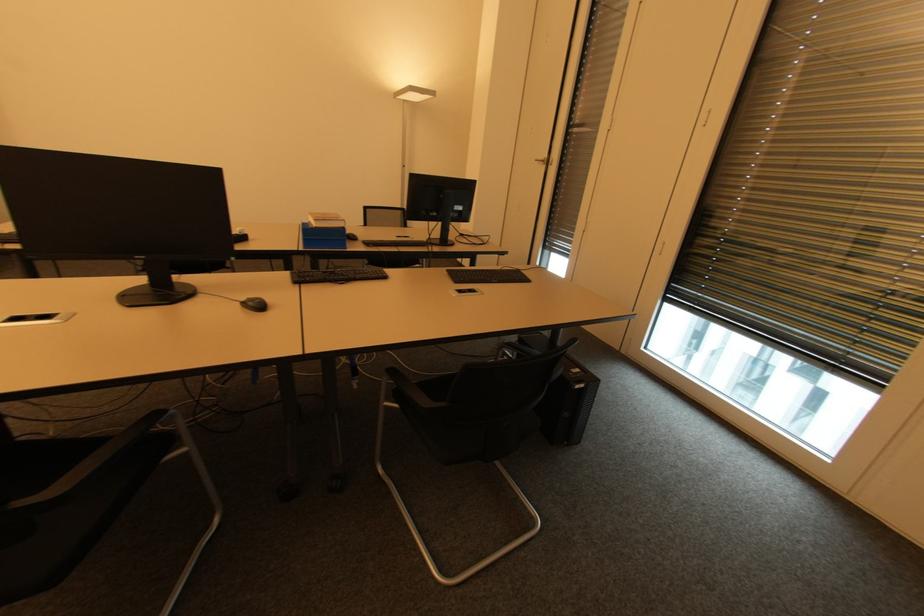
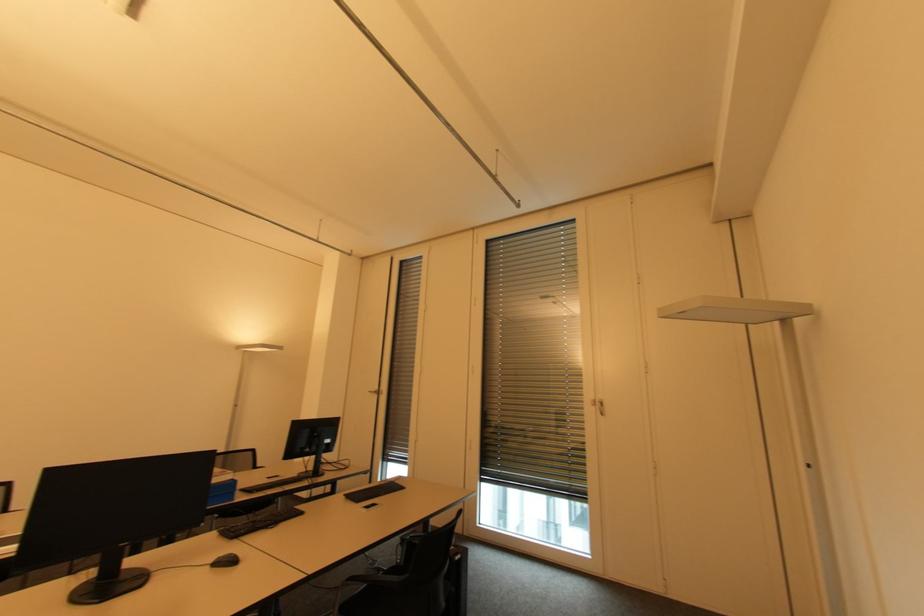
Locate, in the second image, the point that corresponds to the point at 850,353 in the first image.

(573, 485)